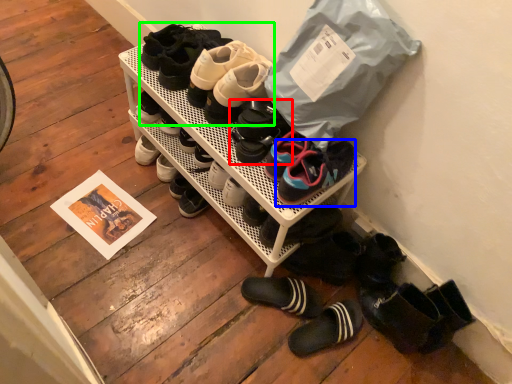
Question: Which is nearer to the footwear (highlighted by a red box)? footwear (highlighted by a blue box) or footwear (highlighted by a green box).

Choices:
 (A) footwear
 (B) footwear

Answer: (A)